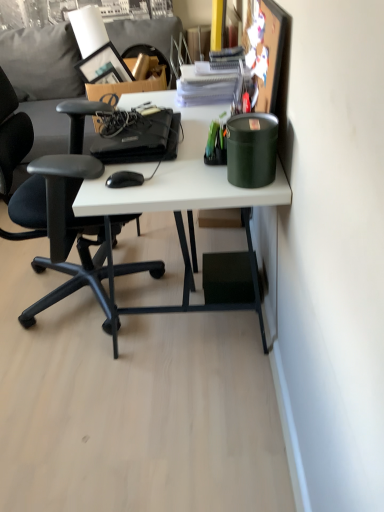
Identify the location of free space to the left of green matte canister at upper right. Image resolution: width=384 pixels, height=512 pixels. pos(198,177).